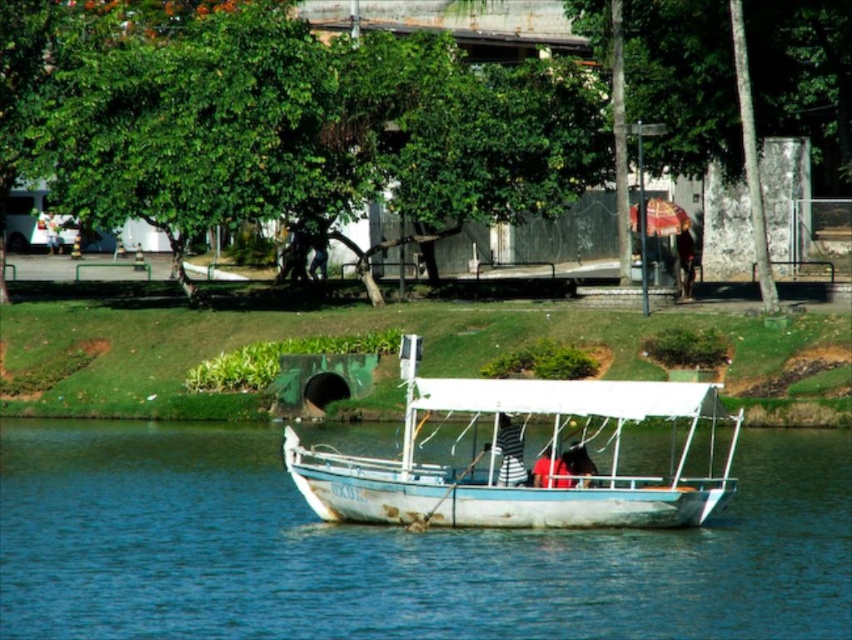
Is point (317, 112) farther from camera compared to point (550, 465)?

That is True.

Does green leafy tree at center have a lesser height compared to red fabric shirt at center?

In fact, green leafy tree at center may be taller than red fabric shirt at center.

At what (x,y) coordinates should I click in order to perform the action: click on green leafy tree at center. Please return your answer as a coordinate pair (x, y). The image size is (852, 640). Looking at the image, I should click on (396, 108).

Does blue wooden boat at center appear on the left side of white matte boat at center?

Yes, blue wooden boat at center is to the left of white matte boat at center.

Where is `blue wooden boat at center`? blue wooden boat at center is located at coordinates (390, 550).

Is point (534, 611) farther from viewer compared to point (659, 518)?

No, (534, 611) is closer to viewer.

This screenshot has height=640, width=852. I want to click on blue wooden boat at center, so click(390, 550).

Which is below, blue wooden boat at center or white fabric umbrella at center?

blue wooden boat at center is below.

Which is behind, point (718, 556) or point (56, 225)?

Point (56, 225)

Identify the location of blue wooden boat at center. The height and width of the screenshot is (640, 852). (390, 550).

You are a GUI agent. You are given a task and a screenshot of the screen. Output one action in this format:
    pyautogui.click(x=<x>, y=<y>)
    Task: Click on the blue wooden boat at center
    The width and height of the screenshot is (852, 640).
    Given the screenshot: What is the action you would take?
    pyautogui.click(x=390, y=550)